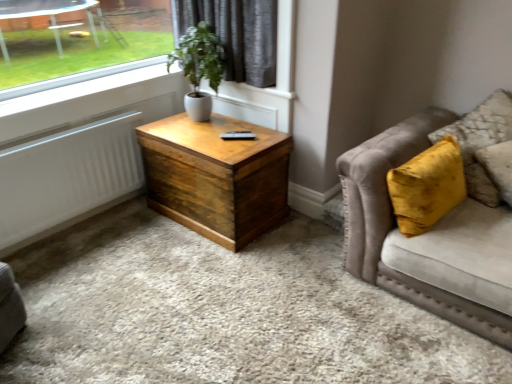
Question: In terms of height, does wooden chest at center look taller or shorter compared to velvet beige couch at right?

Choices:
 (A) short
 (B) tall

Answer: (A)

Question: Which is correct: wooden chest at center is inside velvet beige couch at right, or outside of it?

Choices:
 (A) outside
 (B) inside

Answer: (A)

Question: Estimate the real-world distances between objects in this image. Which object is farther from the velvet beige couch at right?

Choices:
 (A) white ceramic pot at upper center
 (B) wooden chest at center
 (C) white matte radiator at left
 (D) velvet yellow pillow at right

Answer: (C)

Question: Which object is positioned closest to the white ceramic pot at upper center?

Choices:
 (A) white matte radiator at left
 (B) velvet beige couch at right
 (C) wooden chest at center
 (D) velvet yellow pillow at right

Answer: (C)